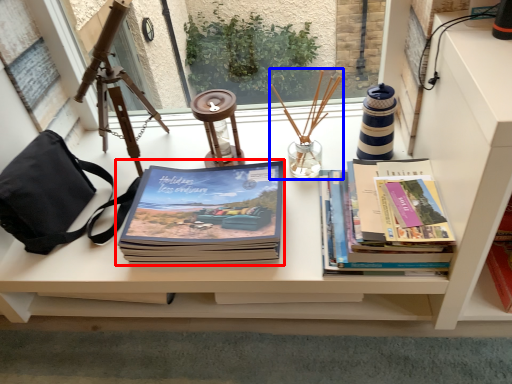
Question: Which of the following is the closest to the observer, book (highlighted by a red box) or candle holder (highlighted by a blue box)?

Choices:
 (A) book
 (B) candle holder

Answer: (A)